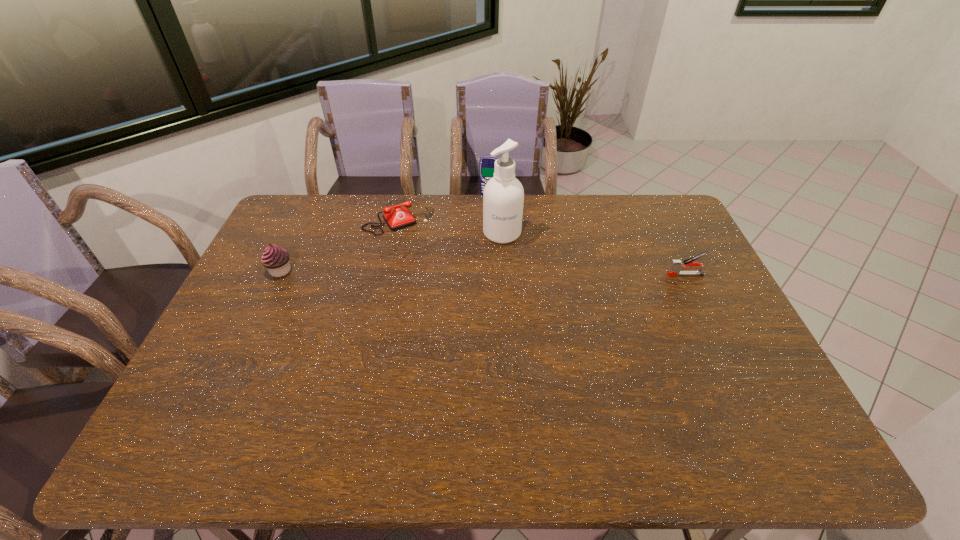
Locate an element on the screen. The image size is (960, 540). free space located on the front-facing side of the cellular telephone is located at coordinates (472, 261).

Where is `free space located on the front-facing side of the cellular telephone`? free space located on the front-facing side of the cellular telephone is located at coordinates (477, 241).

Where is `telephone present at the far edge`? Image resolution: width=960 pixels, height=540 pixels. telephone present at the far edge is located at coordinates (398, 218).

The height and width of the screenshot is (540, 960). I want to click on cleansing agent at the far edge, so click(x=503, y=197).

Identify the location of cellular telephone that is at the far edge. (486, 166).

Find the location of `object that is at the left edge`. object that is at the left edge is located at coordinates click(276, 259).

Locate an element on the screen. The width and height of the screenshot is (960, 540). object located at the right edge is located at coordinates (676, 265).

The height and width of the screenshot is (540, 960). In the image, there is a desktop. What are the coordinates of `free space at the far edge` in the screenshot? It's located at [534, 224].

This screenshot has height=540, width=960. Identify the location of free space at the right edge of the desktop. (714, 305).

In the image, there is a desktop. Identify the location of free space at the far right corner. The image size is (960, 540). (651, 195).